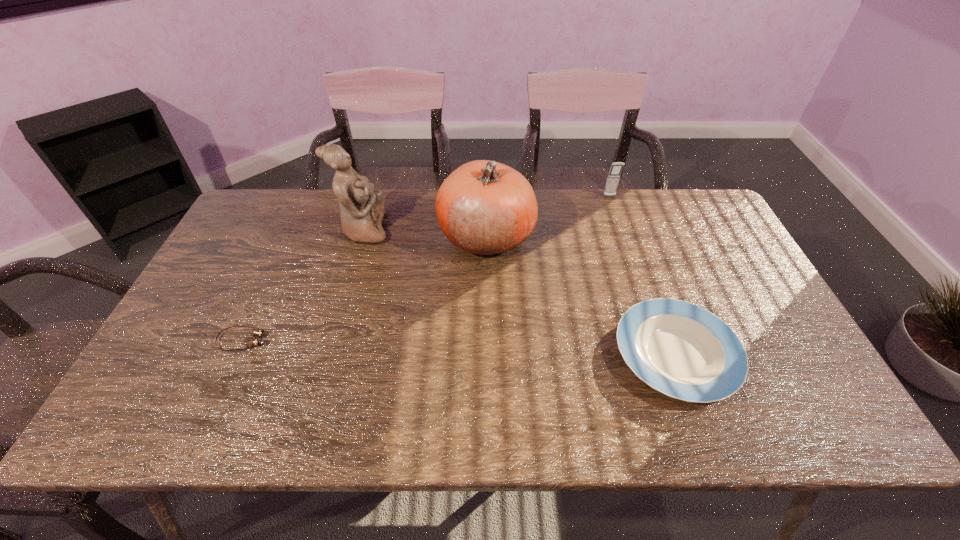
Identify the location of the second object from left to right. tap(361, 207).

Locate an element on the screen. Image resolution: width=960 pixels, height=540 pixels. the third object from right to left is located at coordinates (484, 207).

I want to click on the third shortest object, so click(616, 168).

Image resolution: width=960 pixels, height=540 pixels. Find the location of `cellular telephone`. cellular telephone is located at coordinates (616, 168).

Identify the location of the fourth tallest object. (682, 350).

Find the location of a particular element. The image size is (960, 540). the shortest object is located at coordinates (254, 341).

Locate an element on the screen. The width and height of the screenshot is (960, 540). the leftmost object is located at coordinates (254, 341).

Locate an element on the screen. The image size is (960, 540). vacant region located 0.330m on the front-facing side of the fourth object from right to left is located at coordinates (493, 230).

Image resolution: width=960 pixels, height=540 pixels. I want to click on vacant region located 0.140m on the right of the pumpkin, so click(579, 235).

I want to click on vacant space situated on the front-facing side of the farthest object, so click(x=613, y=209).